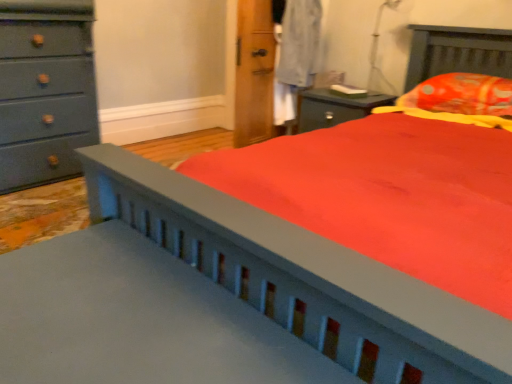
Question: Is transparent plastic table lamp at upper right positioned far away from matte gray dresser at left?

Choices:
 (A) no
 (B) yes

Answer: (B)

Question: Can we say transparent plastic table lamp at upper right lies outside matte gray dresser at left?

Choices:
 (A) no
 (B) yes

Answer: (B)

Question: Does transparent plastic table lamp at upper right have a smaller size compared to matte gray dresser at left?

Choices:
 (A) yes
 (B) no

Answer: (A)

Question: Does transparent plastic table lamp at upper right have a greater height compared to matte gray dresser at left?

Choices:
 (A) no
 (B) yes

Answer: (A)

Question: Is transparent plastic table lamp at upper right facing away from matte gray dresser at left?

Choices:
 (A) no
 (B) yes

Answer: (A)

Question: From a real-world perspective, is transparent plastic table lamp at upper right positioned above or below matte gray dresser at left?

Choices:
 (A) below
 (B) above

Answer: (B)

Question: Is transparent plastic table lamp at upper right inside or outside of matte gray dresser at left?

Choices:
 (A) outside
 (B) inside

Answer: (A)

Question: Looking at their shapes, would you say transparent plastic table lamp at upper right is wider or thinner than matte gray dresser at left?

Choices:
 (A) thin
 (B) wide

Answer: (A)

Question: In terms of height, does transparent plastic table lamp at upper right look taller or shorter compared to matte gray dresser at left?

Choices:
 (A) tall
 (B) short

Answer: (B)

Question: In the image, is orange printed fabric pillow at upper right on the left side or the right side of transparent plastic table lamp at upper right?

Choices:
 (A) left
 (B) right

Answer: (B)

Question: Considering the positions of orange printed fabric pillow at upper right and transparent plastic table lamp at upper right in the image, is orange printed fabric pillow at upper right taller or shorter than transparent plastic table lamp at upper right?

Choices:
 (A) short
 (B) tall

Answer: (A)

Question: From a real-world perspective, relative to transparent plastic table lamp at upper right, is orange printed fabric pillow at upper right vertically above or below?

Choices:
 (A) below
 (B) above

Answer: (A)

Question: Looking at their shapes, would you say orange printed fabric pillow at upper right is wider or thinner than transparent plastic table lamp at upper right?

Choices:
 (A) thin
 (B) wide

Answer: (B)

Question: In the image, is matte gray dresser at left on the left side or the right side of orange printed fabric pillow at upper right?

Choices:
 (A) right
 (B) left

Answer: (B)

Question: Looking at the image, does matte gray dresser at left seem bigger or smaller compared to orange printed fabric pillow at upper right?

Choices:
 (A) big
 (B) small

Answer: (A)